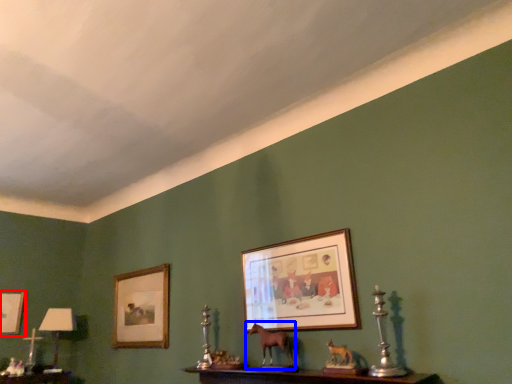
Question: Which object appears farthest to the camera in this image, picture frame (highlighted by a red box) or animal (highlighted by a blue box)?

Choices:
 (A) picture frame
 (B) animal

Answer: (A)